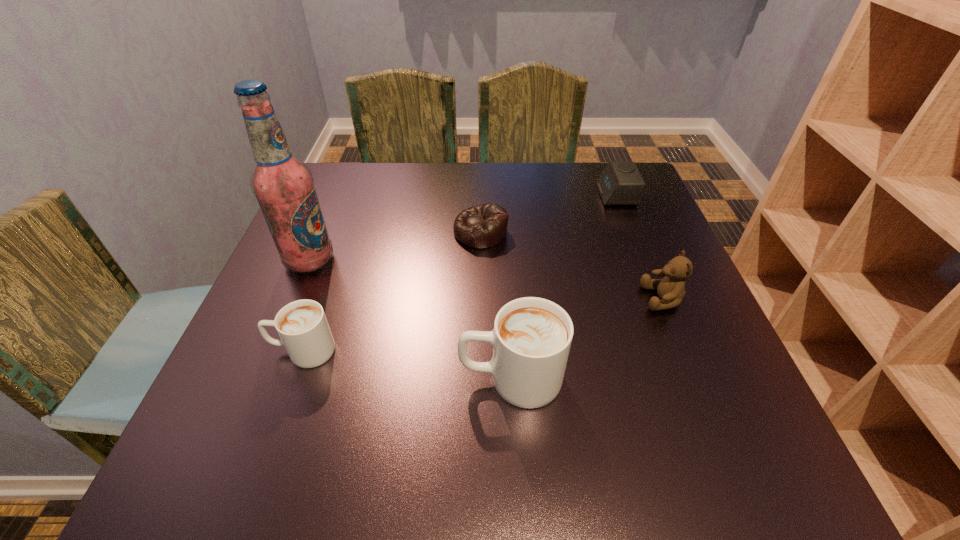
Where is `free space at the left edge of the desktop`? free space at the left edge of the desktop is located at coordinates point(270,334).

The height and width of the screenshot is (540, 960). Identify the location of vacant space at the right edge of the desktop. (612, 219).

Image resolution: width=960 pixels, height=540 pixels. In order to click on blank space at the far left corner in this screenshot , I will do `click(370, 173)`.

Where is `vacant region at the near right corner`? vacant region at the near right corner is located at coordinates (691, 396).

Find the location of `free space between the right cappuccino and the farthest object`. free space between the right cappuccino and the farthest object is located at coordinates (564, 287).

What are the coordinates of `vacant area that lies between the shorter cappuccino and the shortest object` in the screenshot? It's located at (392, 291).

Where is `vacant space that's between the taller cappuccino and the tallest object`? vacant space that's between the taller cappuccino and the tallest object is located at coordinates (410, 319).

You are a GUI agent. You are given a task and a screenshot of the screen. Output one action in this format:
    pyautogui.click(x=<x>, y=<y>)
    Task: Click on the free spot between the beanbag and the taller cappuccino
    This screenshot has height=540, width=960.
    Given the screenshot: What is the action you would take?
    pyautogui.click(x=495, y=305)

Locate an element on the screen. This screenshot has width=960, height=540. vacant area that lies between the shortest object and the shorter cappuccino is located at coordinates (392, 291).

Where is `free spot between the third tallest object and the beanbag`? The height and width of the screenshot is (540, 960). free spot between the third tallest object and the beanbag is located at coordinates (571, 265).